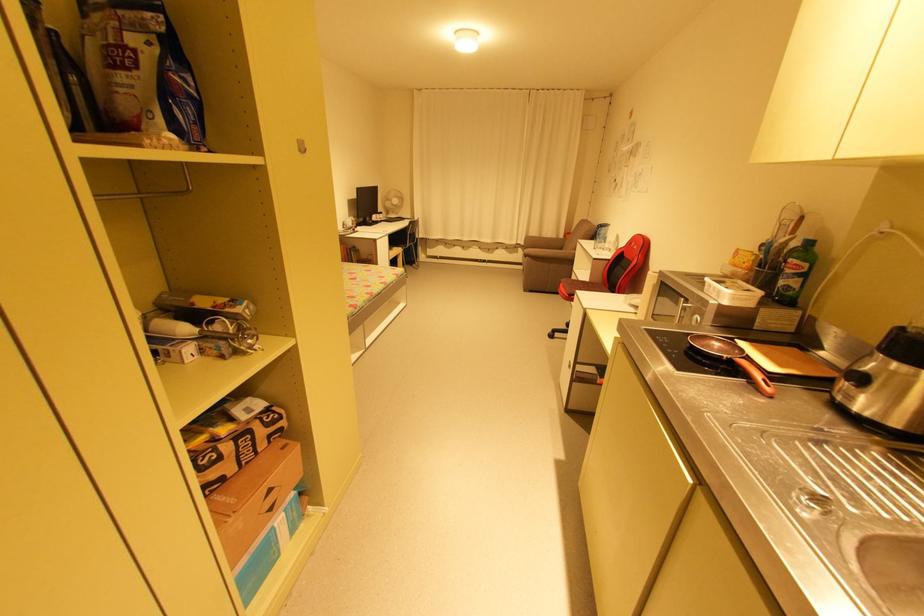
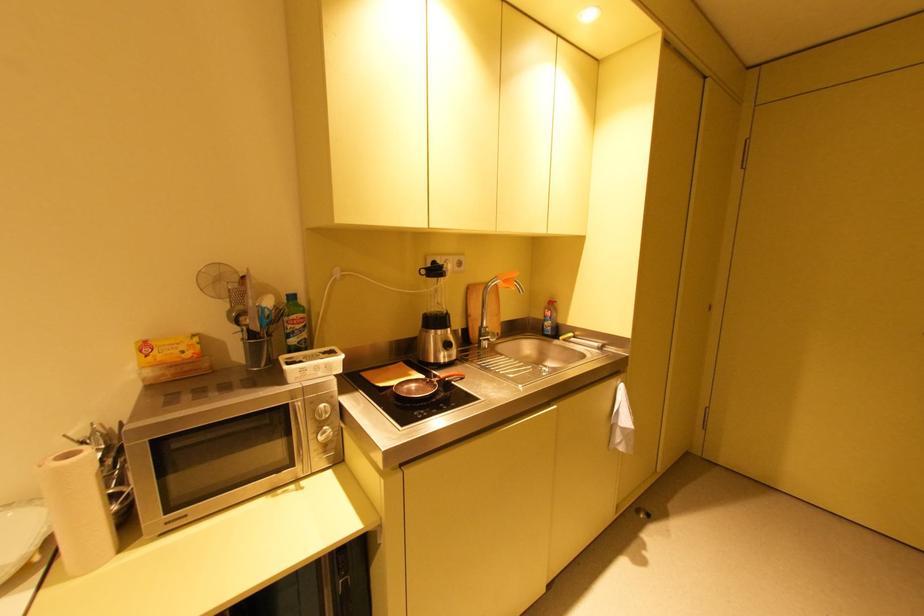
Find the pixel in the second image that matches (x=724, y=347) in the first image.

(420, 387)